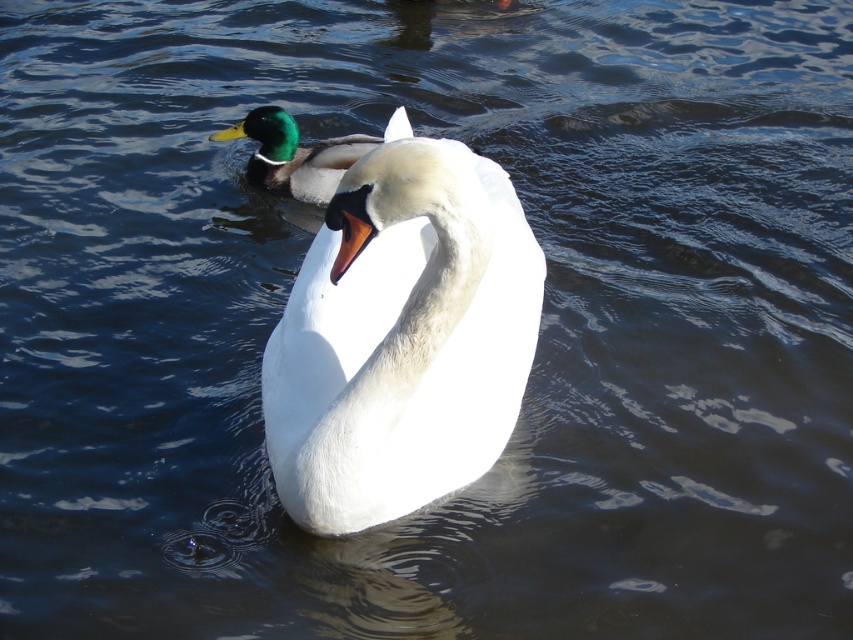
Question: Among these objects, which one is farthest from the camera?

Choices:
 (A) white glossy swan at center
 (B) green glossy duck at upper left

Answer: (B)

Question: Does white glossy swan at center have a lesser width compared to green glossy duck at upper left?

Choices:
 (A) yes
 (B) no

Answer: (B)

Question: Which point is farther to the camera?

Choices:
 (A) white glossy swan at center
 (B) green glossy duck at upper left

Answer: (B)

Question: Is white glossy swan at center above green glossy duck at upper left?

Choices:
 (A) yes
 (B) no

Answer: (B)

Question: Is white glossy swan at center in front of green glossy duck at upper left?

Choices:
 (A) yes
 (B) no

Answer: (A)